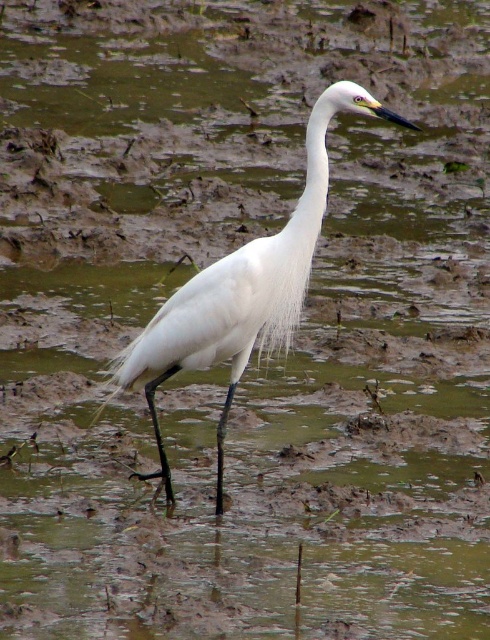
Does point (209, 342) come closer to viewer compared to point (318, 209)?

No, it is not.

Does point (314, 236) come behind point (307, 189)?

Yes, point (314, 236) is farther from viewer.

Where is `white feathered bird at center`? Image resolution: width=490 pixels, height=640 pixels. white feathered bird at center is located at coordinates (242, 291).

The width and height of the screenshot is (490, 640). What are the coordinates of `white feathered bird at center` in the screenshot? It's located at (242, 291).